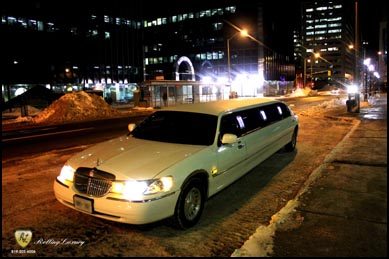
Where is `lighted arch`? The image size is (389, 259). lighted arch is located at coordinates (186, 62).